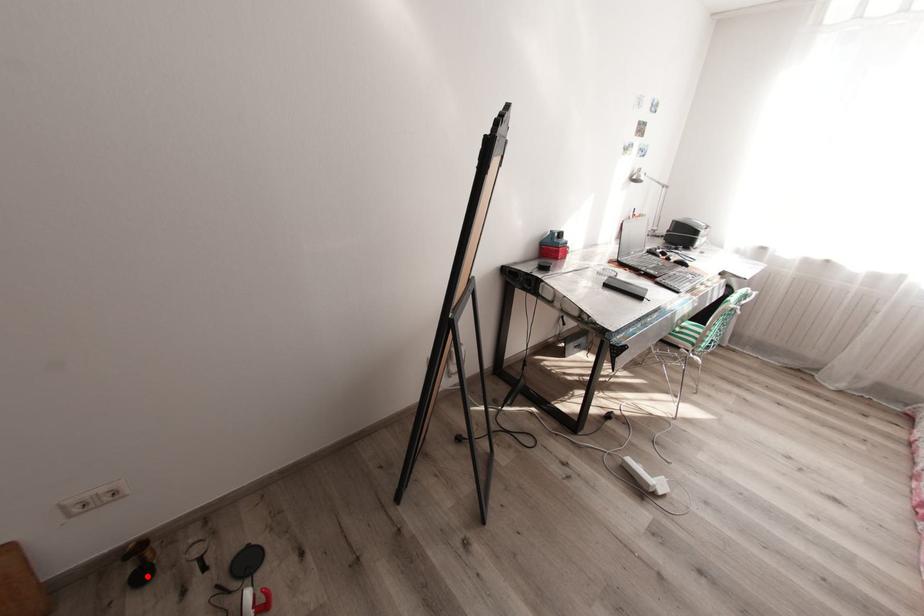
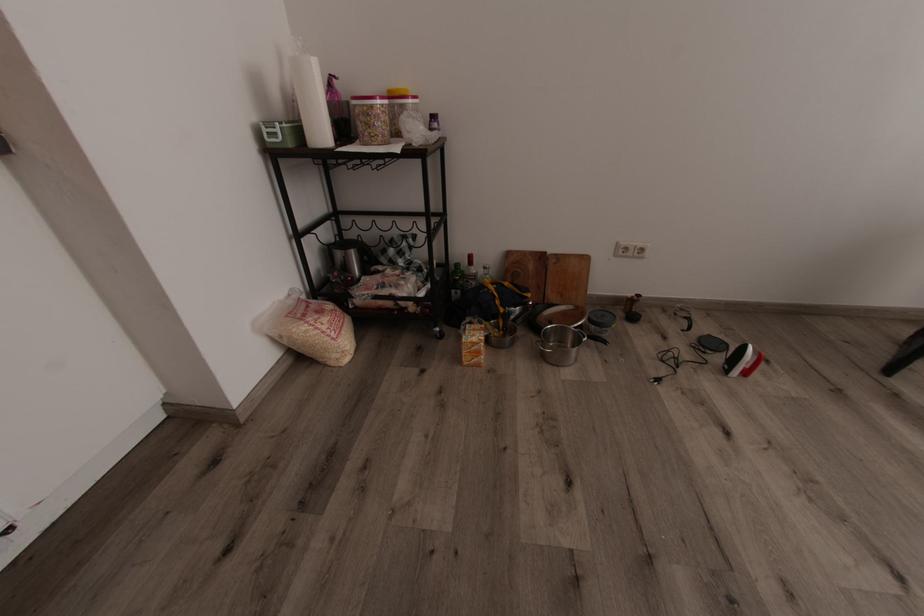
Question: I am providing you with two images of the same scene from different viewpoints. Given a red point in image1, look at the same physical point in image2. Is it:

Choices:
 (A) Closer to the viewpoint
 (B) Farther from the viewpoint

Answer: (A)